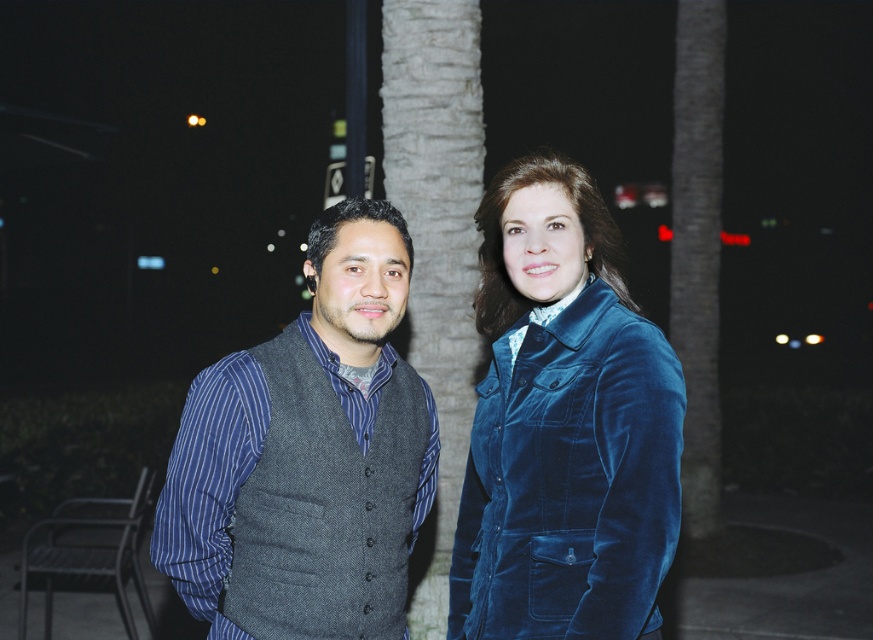
What are the coordinates of the velvet blue jacket at center in the image?

The velvet blue jacket at center is located at point (307, 456).